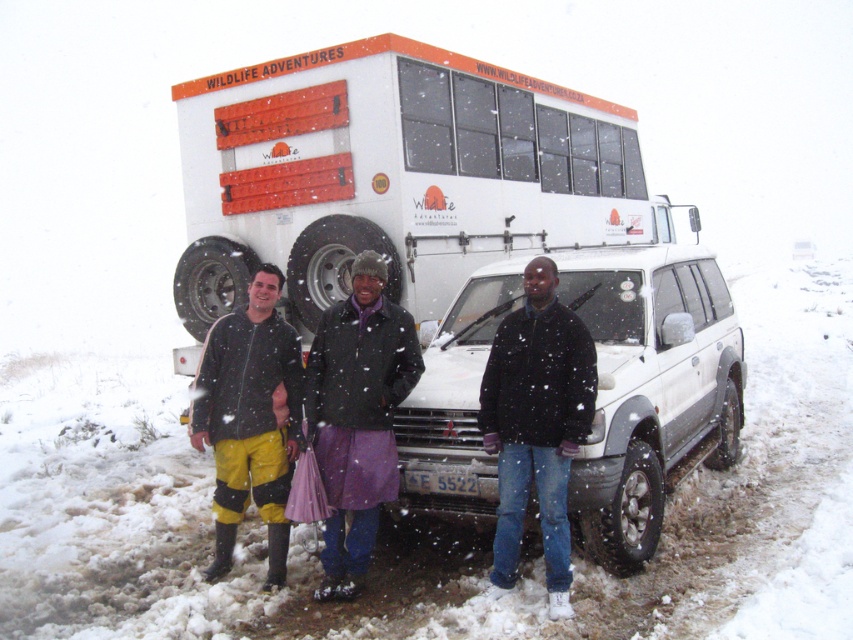
Question: Which object is farther from the camera taking this photo?

Choices:
 (A) white matte suv at center
 (B) yellow rubber boots at lower left

Answer: (B)

Question: Which object appears farthest from the camera in this image?

Choices:
 (A) black matte jacket at center
 (B) white matte suv at center
 (C) yellow rubber boots at lower left

Answer: (C)

Question: Does white matte bus at center have a smaller size compared to white matte suv at center?

Choices:
 (A) yes
 (B) no

Answer: (A)

Question: Does white matte suv at center lie behind black matte jacket at center?

Choices:
 (A) no
 (B) yes

Answer: (B)

Question: Can you confirm if black matte jacket at center is smaller than yellow rubber pants at lower left?

Choices:
 (A) no
 (B) yes

Answer: (B)

Question: Which point appears farthest from the camera in this image?

Choices:
 (A) (x=532, y=467)
 (B) (x=241, y=426)

Answer: (B)